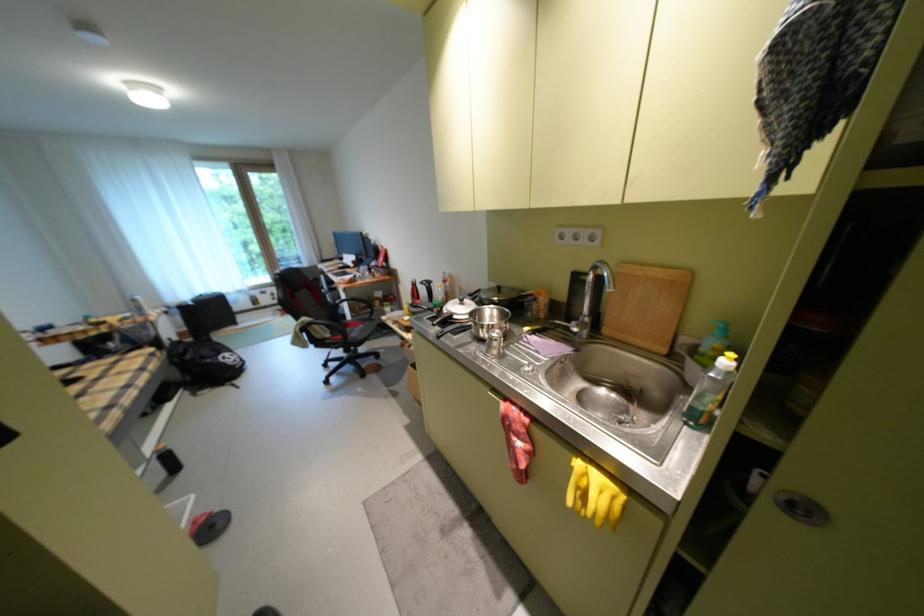
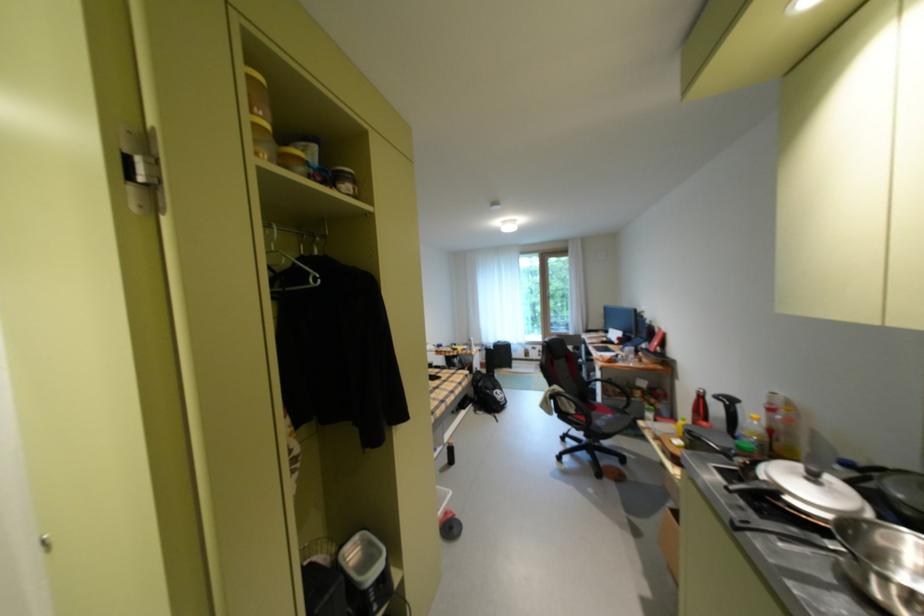
Find the pixel in the second image that matches (x=451, y=299) in the first image.

(766, 439)